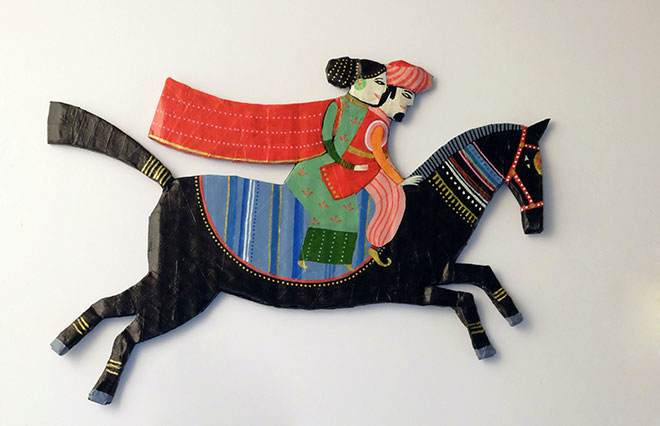
At what (x,y) coordinates should I click in order to perform the action: click on wall. Please return your answer as a coordinate pair (x, y). This screenshot has width=660, height=426. Looking at the image, I should click on (562, 56).